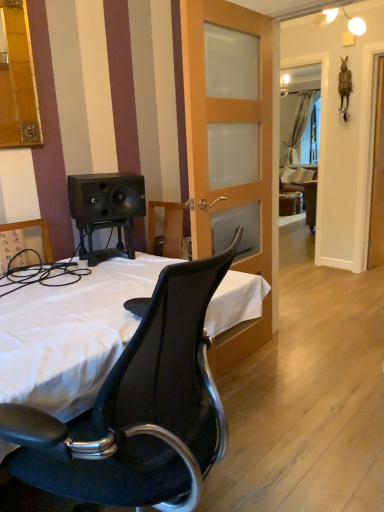
Question: Is white fabric bed at center taller than wooden frosted glass door at center?

Choices:
 (A) no
 (B) yes

Answer: (A)

Question: Is white fabric bed at center looking in the opposite direction of wooden frosted glass door at center?

Choices:
 (A) yes
 (B) no

Answer: (B)

Question: Does white fabric bed at center have a larger size compared to wooden frosted glass door at center?

Choices:
 (A) yes
 (B) no

Answer: (A)

Question: Can you confirm if white fabric bed at center is thinner than wooden frosted glass door at center?

Choices:
 (A) no
 (B) yes

Answer: (A)

Question: Does white fabric bed at center appear on the right side of wooden frosted glass door at center?

Choices:
 (A) no
 (B) yes

Answer: (A)

Question: Is white fabric bed at center surrounding wooden frosted glass door at center?

Choices:
 (A) no
 (B) yes

Answer: (A)

Question: Is clear glass screen door at right facing away from white fabric bed at center?

Choices:
 (A) yes
 (B) no

Answer: (B)

Question: Can you confirm if clear glass screen door at right is positioned to the right of white fabric bed at center?

Choices:
 (A) yes
 (B) no

Answer: (A)

Question: Considering the relative sizes of clear glass screen door at right and white fabric bed at center in the image provided, is clear glass screen door at right bigger than white fabric bed at center?

Choices:
 (A) no
 (B) yes

Answer: (A)

Question: Can you confirm if clear glass screen door at right is wider than white fabric bed at center?

Choices:
 (A) yes
 (B) no

Answer: (B)

Question: From the image's perspective, is clear glass screen door at right above white fabric bed at center?

Choices:
 (A) no
 (B) yes

Answer: (B)

Question: Considering the relative sizes of clear glass screen door at right and white fabric bed at center in the image provided, is clear glass screen door at right shorter than white fabric bed at center?

Choices:
 (A) yes
 (B) no

Answer: (B)

Question: Does wooden frosted glass door at center have a greater width compared to white fabric bed at center?

Choices:
 (A) no
 (B) yes

Answer: (A)